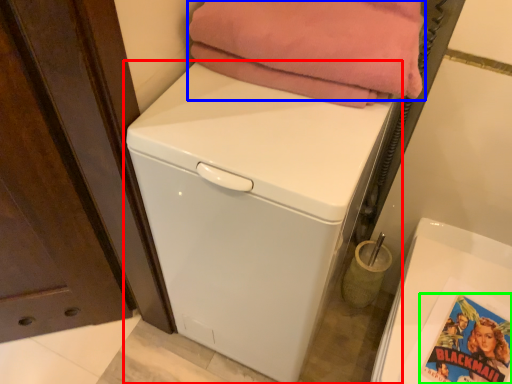
Question: Which is nearer to the washing machine (highlighted by a red box)? blanket (highlighted by a blue box) or comic book (highlighted by a green box).

Choices:
 (A) blanket
 (B) comic book

Answer: (A)